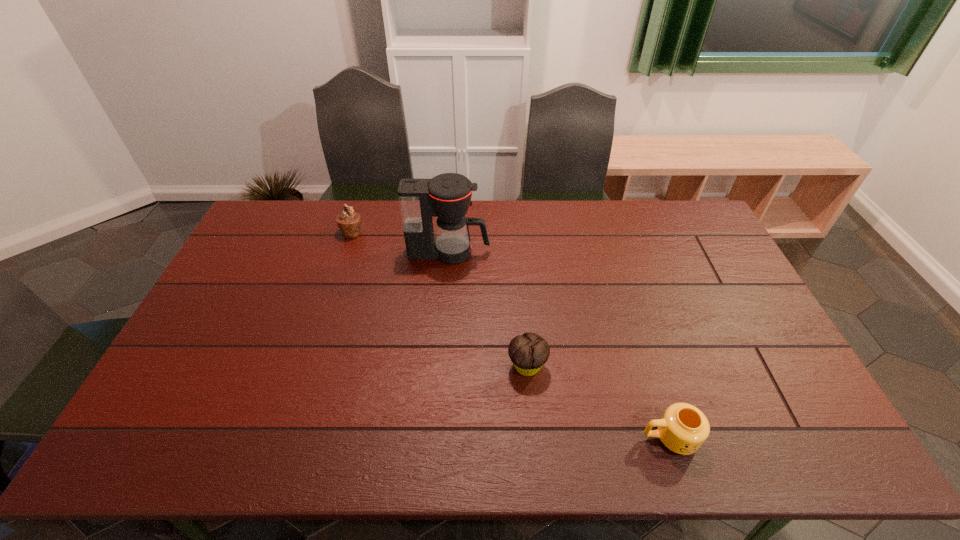
Locate an element on the screen. This screenshot has width=960, height=540. blank region between the leftmost object and the third object from right to left is located at coordinates (400, 242).

Find the location of `vacant space that is in between the mug and the tallest object`. vacant space that is in between the mug and the tallest object is located at coordinates (560, 345).

Find the location of a particular element. vacant area between the nearest object and the farther muffin is located at coordinates (511, 335).

I want to click on object identified as the closest to the leftmost object, so click(447, 196).

Point out which object is positioned as the third nearest to the rightmost object. Please provide its 2D coordinates. Your answer should be formatted as a tuple, i.e. [(x, y)], where the tuple contains the x and y coordinates of a point satisfying the conditions above.

[(349, 222)]

Locate an element on the screen. The width and height of the screenshot is (960, 540). free spot that satisfies the following two spatial constraints: 1. on the back side of the third object from left to right; 2. pour from the carafe of the tallest object is located at coordinates (517, 252).

Where is `vacant position in the image that satisfies the following two spatial constraints: 1. pour from the carafe of the right muffin; 2. on the left side of the third object from right to left`? The height and width of the screenshot is (540, 960). vacant position in the image that satisfies the following two spatial constraints: 1. pour from the carafe of the right muffin; 2. on the left side of the third object from right to left is located at coordinates (441, 366).

Where is `free space that satisfies the following two spatial constraints: 1. on the front side of the farther muffin; 2. on the left side of the second object from right to left`? This screenshot has height=540, width=960. free space that satisfies the following two spatial constraints: 1. on the front side of the farther muffin; 2. on the left side of the second object from right to left is located at coordinates (309, 366).